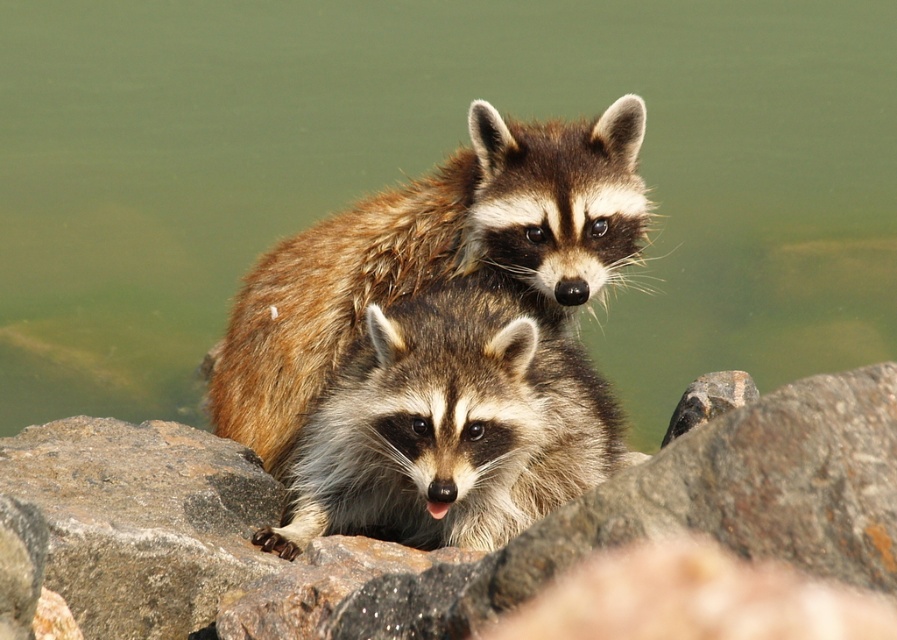
Question: Which is nearer to the fuzzy brown raccoon at center?

Choices:
 (A) brown furry raccoon at center
 (B) brown rough rock at center
 (C) green water at center

Answer: (A)

Question: Is green water at center closer to camera compared to brown rough rock at center?

Choices:
 (A) yes
 (B) no

Answer: (B)

Question: Which point is closer to the camera?

Choices:
 (A) brown rough rock at center
 (B) brown furry raccoon at center
 (C) green water at center

Answer: (A)

Question: Is green water at center above brown furry raccoon at center?

Choices:
 (A) no
 (B) yes

Answer: (B)

Question: Which of the following is the farthest from the observer?

Choices:
 (A) (660, 176)
 (B) (806, 502)
 (C) (521, 413)
 (D) (323, 323)

Answer: (A)

Question: Can you confirm if green water at center is bigger than fuzzy brown raccoon at center?

Choices:
 (A) no
 (B) yes

Answer: (B)